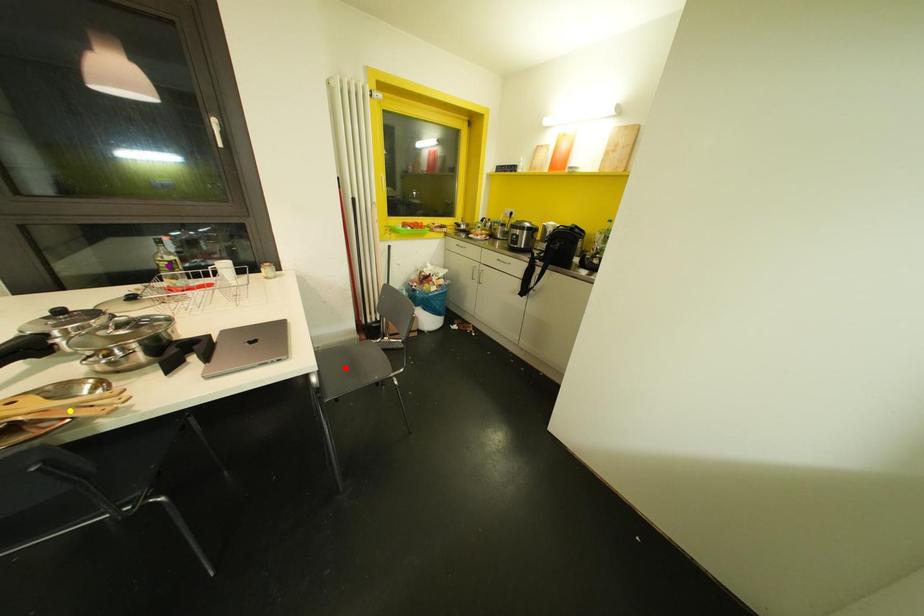
Order these from farthest to nearest:
red point, yellow point, purple point

1. red point
2. purple point
3. yellow point